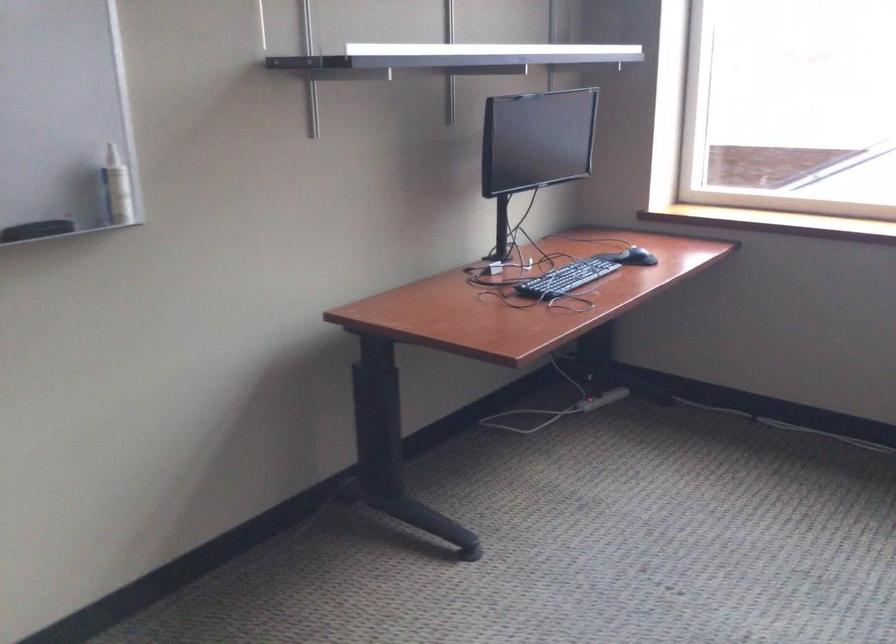
What do you see at coordinates (587, 404) in the screenshot? I see `the power strip switch` at bounding box center [587, 404].